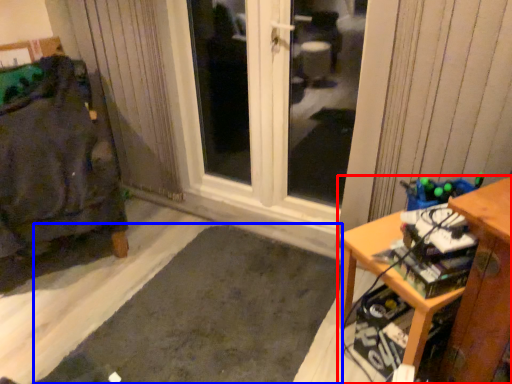
Question: Which point is closer to the camera, desk (highlighted by a red box) or doormat (highlighted by a blue box)?

Choices:
 (A) desk
 (B) doormat

Answer: (B)